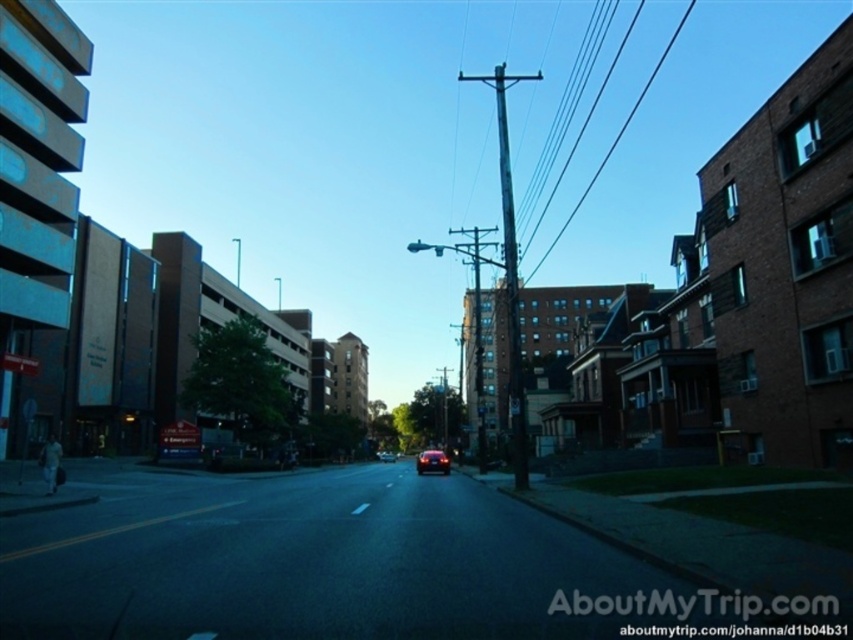
You are a delivery person who needs to park your shiny silver sedan at center without blocking the weathered wood telegraph pole at center. Since the telegraph pole is larger, where should you position your car relative to it?

The weathered wood telegraph pole at center has a larger size compared to the shiny silver sedan at center. To park without blocking it, position the shiny silver sedan at center so it does not obstruct the telegraph pole, considering the pole takes up more space.

Consider the image. You are a bird flying at an altitude of 100 meters above the ground. You spot the weathered wood telegraph pole at center and the metallic wire at center from your vantage point. Which object is closer to you?

The weathered wood telegraph pole at center is closer to you because it is only 237.91 meters away from the metallic wire at center, so the pole is nearer than the wire.

You are a delivery driver who needs to drive a truck that is 2.5 meters tall under the weathered wood telegraph pole at center and the shiny silver sedan at center. Can your truck pass under the telegraph pole without hitting it?

The weathered wood telegraph pole at center is taller than the shiny silver sedan at center. Since the truck is 2.5 meters tall, you need to compare the height of the telegraph pole. However, the exact height of the telegraph pole isn not provided in the description. Therefore, it is uncertain if the truck can pass under it without hitting the pole.